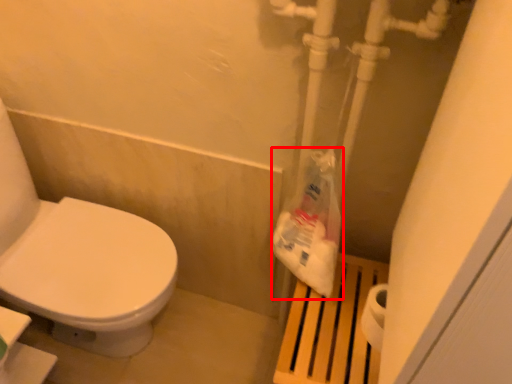
Question: From the image's perspective, what is the correct spatial positioning of paper bag (annotated by the red box) in reference to step stool?

Choices:
 (A) above
 (B) below

Answer: (A)